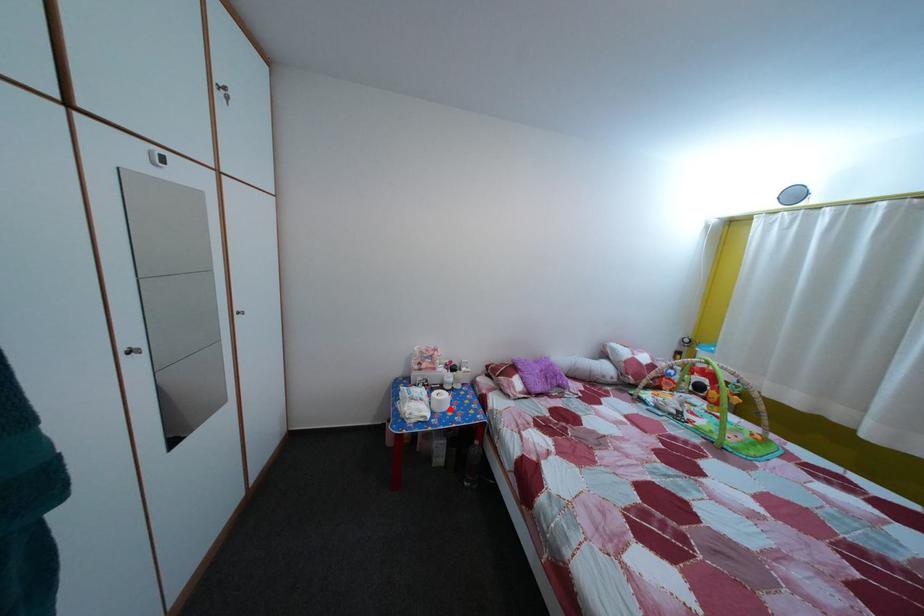
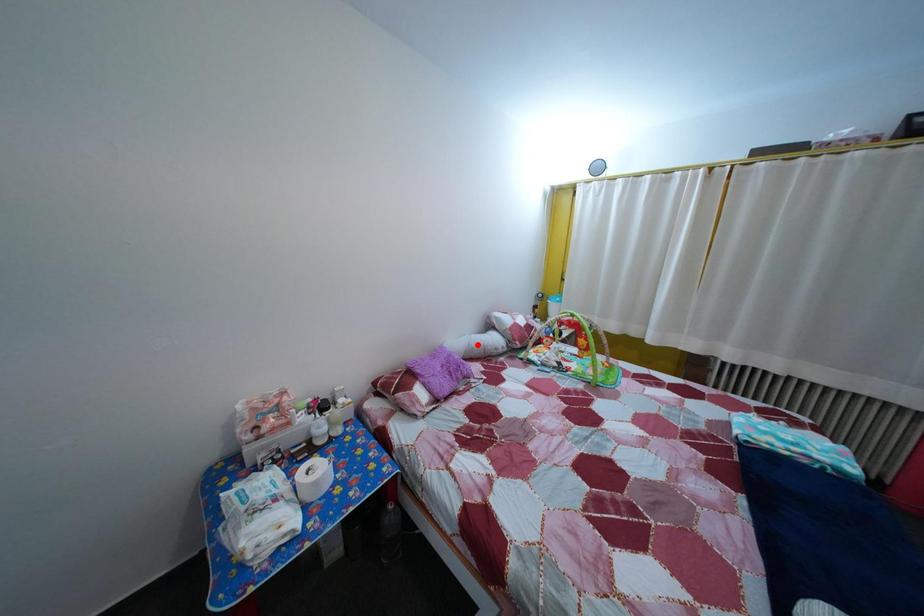
I am providing you with two images of the same scene from different viewpoints. A red point is marked on the first image and another point is marked on the second image. Do the highlighted points in image1 and image2 indicate the same real-world spot?

No